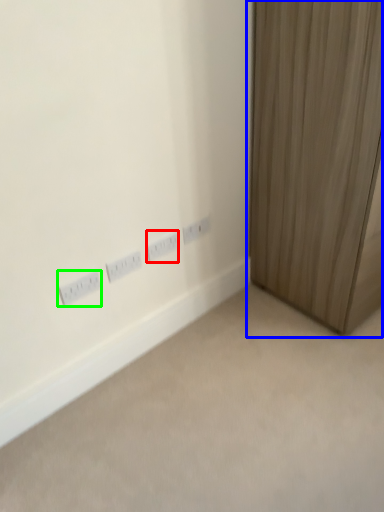
Question: Which is farther away from power plugs and sockets (highlighted by a red box)? curtain (highlighted by a blue box) or power plugs and sockets (highlighted by a green box)?

Choices:
 (A) curtain
 (B) power plugs and sockets

Answer: (A)